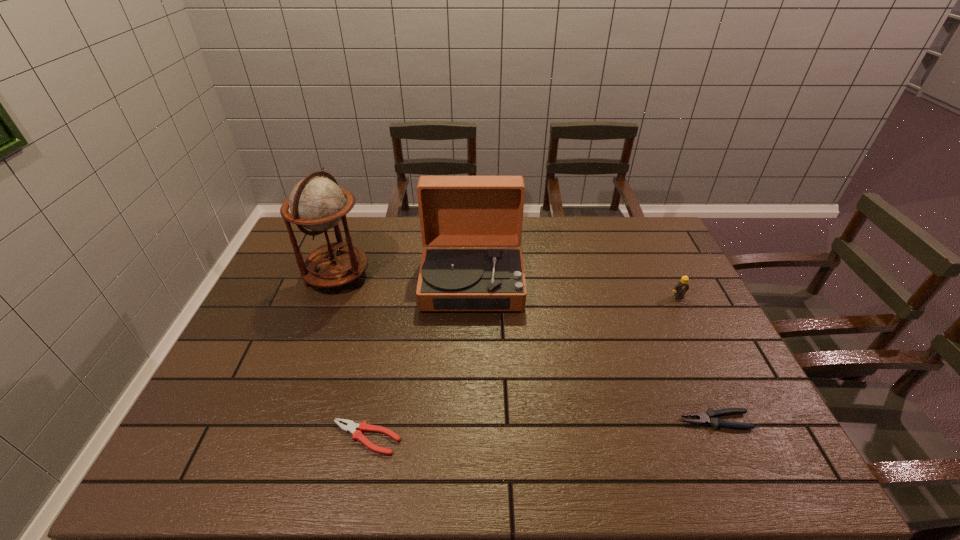
Where is `vacant area in the image that satisfies the following two spatial constraints: 1. in front of the Lego; 2. at the gripping part of the taller pliers`? vacant area in the image that satisfies the following two spatial constraints: 1. in front of the Lego; 2. at the gripping part of the taller pliers is located at coordinates (738, 421).

This screenshot has height=540, width=960. What are the coordinates of `vacant space that satisfies the following two spatial constraints: 1. on the surface of the leftmost object; 2. on the left side of the shorter pliers` in the screenshot? It's located at (277, 438).